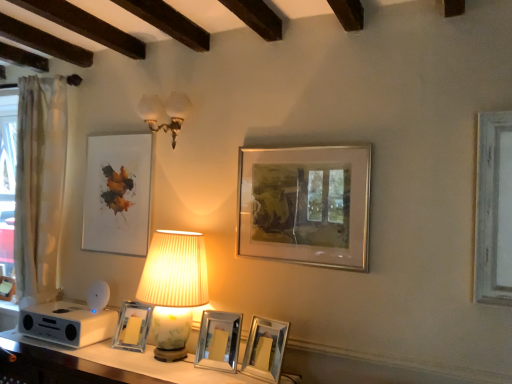
Locate an element on the screen. This screenshot has width=512, height=384. vacant space to the left of matte white lampshade at center, acting as the second lamp starting from the top is located at coordinates (103, 356).